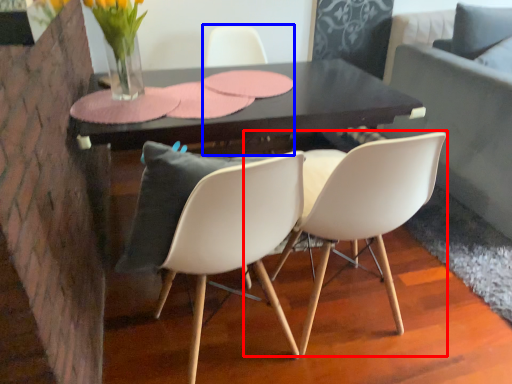
Question: Which object is closer to the camera taking this photo, chair (highlighted by a red box) or chair (highlighted by a blue box)?

Choices:
 (A) chair
 (B) chair

Answer: (A)